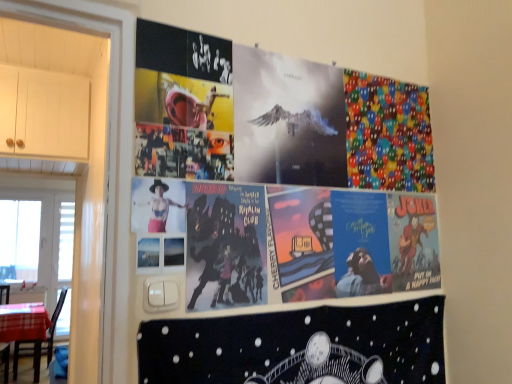
What do you see at coordinates (39, 246) in the screenshot?
I see `white plastic window screen at left, which is the second window screen from back to front` at bounding box center [39, 246].

Identify the location of black matte poster at lower center. This screenshot has width=512, height=384. (298, 346).

From the picture: What is the approximate height of brown wooden chair at lower left?

brown wooden chair at lower left is 97.94 centimeters tall.

At what (x,y) coordinates should I click in order to perform the action: click on matte black figure at center. Please return your answer as a coordinate pair (x, y). This screenshot has height=384, width=512. Looking at the image, I should click on (160, 207).

Visually, is colorful fabric pac-man at upper right positioned to the left or to the right of transparent glass window at left, the first window screen positioned from the back?

From the image, it's evident that colorful fabric pac-man at upper right is to the right of transparent glass window at left, the first window screen positioned from the back.

From a real-world perspective, between colorful fabric pac-man at upper right and transparent glass window at left, positioned as the 2th window screen in right-to-left order, who is vertically lower?

In real-world perspective, transparent glass window at left, positioned as the 2th window screen in right-to-left order, is lower.

Between point (399, 112) and point (6, 229), which one is positioned in front?

Positioned in front is point (399, 112).

Does colorful fabric pac-man at upper right lie in front of transparent glass window at left, which is counted as the second window screen, starting from the front?

Yes, it is.

Is the surface of matte black figure at center in direct contact with black matte poster at lower center?

No, matte black figure at center is not beside black matte poster at lower center.

Is point (183, 208) positioned behind point (394, 370)?

No, (183, 208) is in front of (394, 370).

Does matte black figure at center turn towards black matte poster at lower center?

No, matte black figure at center is not oriented towards black matte poster at lower center.

Would you say black matte poster at lower center is a long distance from white plastic window screen at left, which is the second window screen from back to front?

Indeed, black matte poster at lower center is not near white plastic window screen at left, which is the second window screen from back to front.

Can you tell me how much black matte poster at lower center and white plastic window screen at left, the 1th window screen positioned from the right, differ in facing direction?

They differ by 2.19 degrees in their facing directions.

At what (x,y) coordinates should I click in order to perform the action: click on the 1st window screen positioned below the black matte poster at lower center (from the image's perspective). Please return your answer as a coordinate pair (x, y). This screenshot has width=512, height=384. Looking at the image, I should click on (39, 246).

From a real-world perspective, is black matte poster at lower center above or below white plastic window screen at left, the 1th window screen positioned from the right?

From a real-world perspective, black matte poster at lower center is physically below white plastic window screen at left, the 1th window screen positioned from the right.

Looking at this image, from the image's perspective, is white plastic window screen at left, which is the second window screen from back to front, below colorful fabric pac-man at upper right?

Yes, from the image's perspective, white plastic window screen at left, which is the second window screen from back to front, is beneath colorful fabric pac-man at upper right.

This screenshot has height=384, width=512. Identify the location of comic book in front of the white plastic window screen at left, the 1th window screen positioned from the right. (387, 134).

From a real-world perspective, is white plastic window screen at left, the 1th window screen positioned from the right, positioned over colorful fabric pac-man at upper right based on gravity?

No.

Is white plastic window screen at left, marked as the 2th window screen in a left-to-right arrangement, not inside metallic silver poster at center?

Indeed, white plastic window screen at left, marked as the 2th window screen in a left-to-right arrangement, is completely outside metallic silver poster at center.

Relative to metallic silver poster at center, is white plastic window screen at left, the 1th window screen positioned from the right, in front or behind?

In the image, white plastic window screen at left, the 1th window screen positioned from the right, appears behind metallic silver poster at center.

Between white plastic window screen at left, which is the second window screen from back to front, and metallic silver poster at center, which one has smaller size?

Smaller between the two is metallic silver poster at center.

Which is behind, point (7, 204) or point (326, 172)?

The point (7, 204) is farther.

Which object is positioned more to the left, metallic silver poster at center or matte black figure at center?

Positioned to the left is matte black figure at center.

Who is shorter, metallic silver poster at center or matte black figure at center?

matte black figure at center is shorter.

Is metallic silver poster at center further to camera compared to matte black figure at center?

That is True.

From the image's perspective, is metallic silver poster at center on matte black figure at center?

Yes, from the image's perspective, metallic silver poster at center is above matte black figure at center.

Is brown wooden chair at lower left beside white plastic window screen at left, marked as the 2th window screen in a left-to-right arrangement?

No, brown wooden chair at lower left is not making contact with white plastic window screen at left, marked as the 2th window screen in a left-to-right arrangement.

How far apart are brown wooden chair at lower left and white plastic window screen at left, marked as the 2th window screen in a left-to-right arrangement?

They are 41.81 centimeters apart.

Which object is more forward, brown wooden chair at lower left or white plastic window screen at left, the first window screen viewed from the front?

white plastic window screen at left, the first window screen viewed from the front, is more forward.

From a real-world perspective, who is located lower, brown wooden chair at lower left or white plastic window screen at left, marked as the 2th window screen in a left-to-right arrangement?

From a 3D spatial view, brown wooden chair at lower left is below.

The width and height of the screenshot is (512, 384). I want to click on comic book above the transparent glass window at left, which is counted as the second window screen, starting from the front (from a real-world perspective), so click(387, 134).

Find the location of a particular element. album cover below the matte black figure at center (from the image's perspective) is located at coordinates (298, 346).

Estimate the real-world distances between objects in this image. Which object is further from black matte poster at lower center, brown wooden chair at lower left or transparent glass window at left, positioned as the first window screen in left-to-right order?

The object further to black matte poster at lower center is transparent glass window at left, positioned as the first window screen in left-to-right order.

Based on their spatial positions, is transparent glass window at left, which is counted as the second window screen, starting from the front, or matte black figure at center further from brown wooden chair at lower left?

Among the two, matte black figure at center is located further to brown wooden chair at lower left.

Considering their positions, is white plastic window screen at left, the first window screen viewed from the front, positioned further to black matte poster at lower center than brown wooden chair at lower left?

brown wooden chair at lower left is positioned further to the anchor black matte poster at lower center.

Considering their positions, is matte black figure at center positioned further to black matte poster at lower center than white plastic window screen at left, which is the second window screen from back to front?

Based on the image, white plastic window screen at left, which is the second window screen from back to front, appears to be further to black matte poster at lower center.

Based on their spatial positions, is white plastic window screen at left, the first window screen viewed from the front, or metallic silver poster at center closer to brown wooden chair at lower left?

white plastic window screen at left, the first window screen viewed from the front, lies closer to brown wooden chair at lower left than the other object.

From the image, which object appears to be farther from metallic silver poster at center, white plastic window screen at left, marked as the 2th window screen in a left-to-right arrangement, or matte black figure at center?

The object further to metallic silver poster at center is white plastic window screen at left, marked as the 2th window screen in a left-to-right arrangement.

Based on their spatial positions, is transparent glass window at left, positioned as the 2th window screen in right-to-left order, or metallic silver poster at center further from white plastic window screen at left, marked as the 2th window screen in a left-to-right arrangement?

metallic silver poster at center.

Based on their spatial positions, is metallic silver poster at center or colorful fabric pac-man at upper right closer to black matte poster at lower center?

metallic silver poster at center is positioned closer to the anchor black matte poster at lower center.

Locate an element on the screen. The width and height of the screenshot is (512, 384). album cover between white plastic window screen at left, the first window screen viewed from the front, and colorful fabric pac-man at upper right is located at coordinates tap(298, 346).

You are a GUI agent. You are given a task and a screenshot of the screen. Output one action in this format:
    pyautogui.click(x=<x>, y=<y>)
    Task: Click on the window screen located between metallic silver poster at center and transparent glass window at left, positioned as the first window screen in left-to-right order, in the depth direction
    The width and height of the screenshot is (512, 384).
    Given the screenshot: What is the action you would take?
    pyautogui.click(x=39, y=246)

The image size is (512, 384). Find the location of `window screen located between matte black figure at center and transparent glass window at left, which is counted as the second window screen, starting from the front, in the depth direction`. window screen located between matte black figure at center and transparent glass window at left, which is counted as the second window screen, starting from the front, in the depth direction is located at coordinates (39, 246).

Find the location of a particular element. The width and height of the screenshot is (512, 384). person that lies between metallic silver poster at center and black matte poster at lower center from top to bottom is located at coordinates (160, 207).